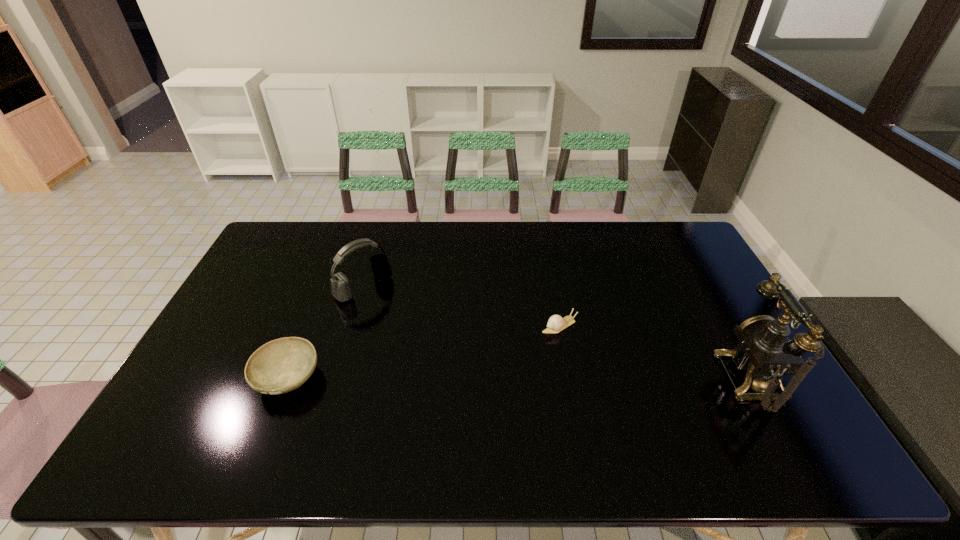
At what (x,y) coordinates should I click in order to perform the action: click on the third tallest object. Please return your answer as a coordinate pair (x, y). This screenshot has width=960, height=540. Looking at the image, I should click on (282, 365).

The image size is (960, 540). What are the coordinates of `telephone` in the screenshot? It's located at (765, 352).

What are the coordinates of `the rightmost object` in the screenshot? It's located at (765, 352).

I want to click on the third shortest object, so click(341, 289).

Locate an element on the screen. headset is located at coordinates (341, 289).

Locate an element on the screen. The image size is (960, 540). the second object from right to left is located at coordinates (556, 323).

I want to click on the shortest object, so click(x=556, y=323).

Identify the location of free point located 0.170m on the right of the bowl. (384, 377).

Find the location of a particular element. The width and height of the screenshot is (960, 540). blank area located on the headband of the headset is located at coordinates (418, 338).

I want to click on free region located on the headband of the headset, so click(454, 373).